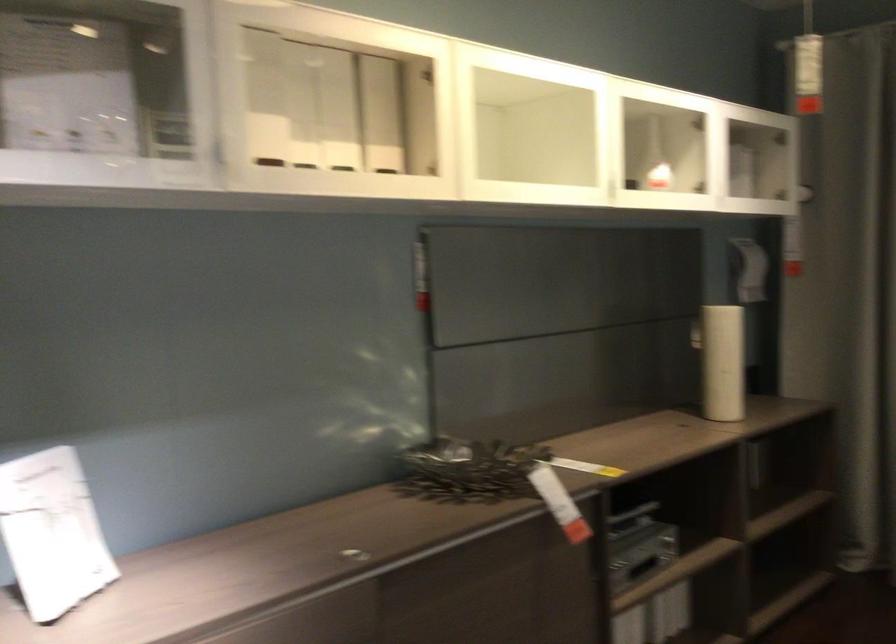
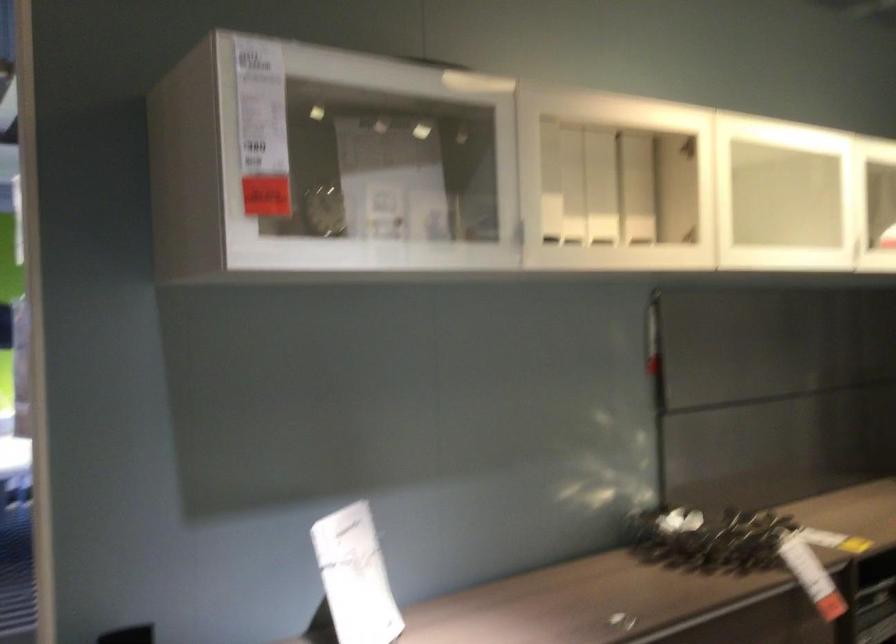
In the second image, find the point that corresponds to (433,75) in the first image.

(688, 147)